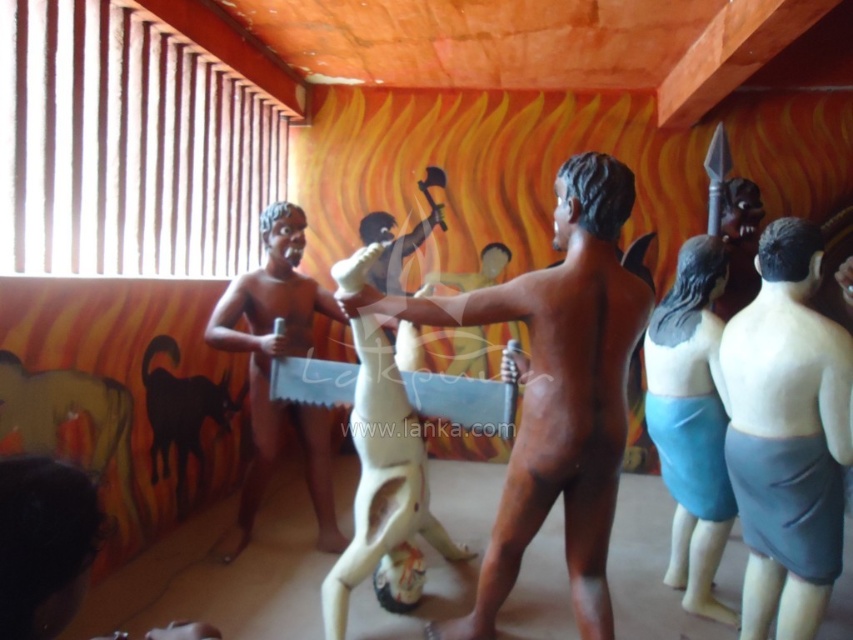
Question: Which object is farther from the camera taking this photo?

Choices:
 (A) brown matte statue at center
 (B) gray matte skirt at center
 (C) blue fabric skirt at center
 (D) matte plastic man at center

Answer: (D)

Question: Is blue fabric skirt at center wider than matte plastic man at center?

Choices:
 (A) yes
 (B) no

Answer: (B)

Question: Does brown matte statue at center appear under blue fabric skirt at center?

Choices:
 (A) yes
 (B) no

Answer: (B)

Question: Estimate the real-world distances between objects in this image. Which object is closer to the gray matte skirt at center?

Choices:
 (A) matte plastic man at center
 (B) brown matte statue at center

Answer: (B)

Question: Can you confirm if brown matte statue at center is positioned above gray matte skirt at center?

Choices:
 (A) no
 (B) yes

Answer: (B)

Question: Which of the following is the closest to the observer?

Choices:
 (A) gray matte skirt at center
 (B) brown matte statue at center

Answer: (B)